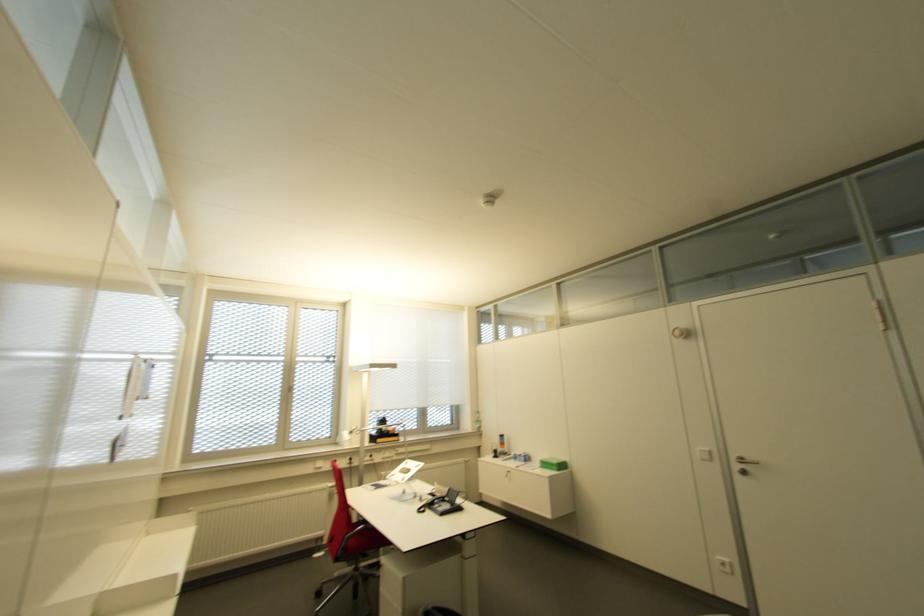
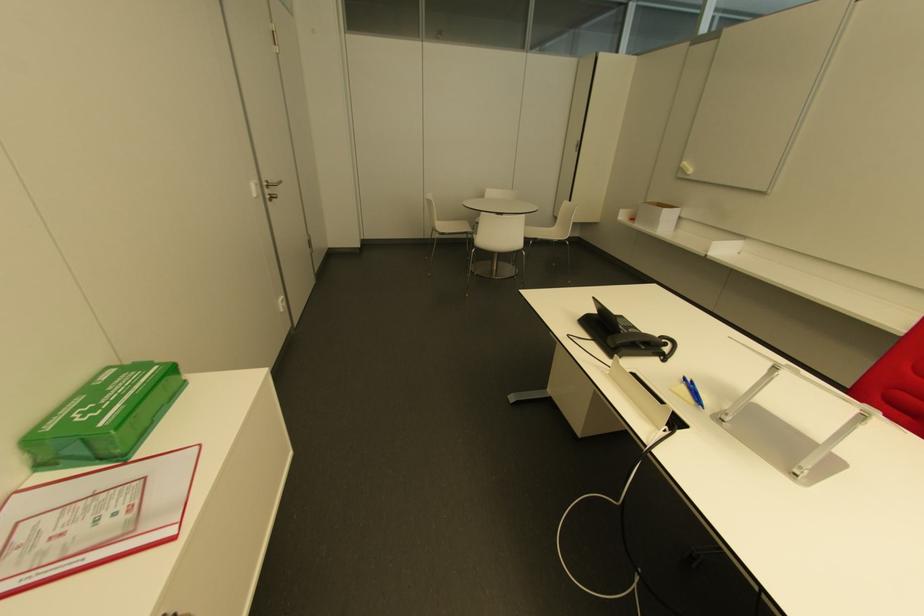
Locate, in the second image, the point that corresponds to point (758, 464) in the first image.

(278, 182)